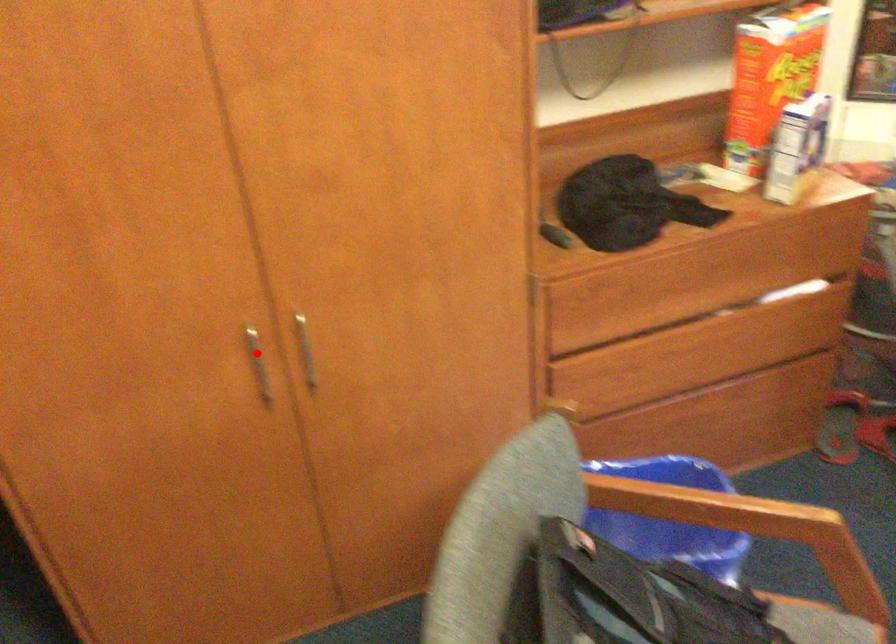
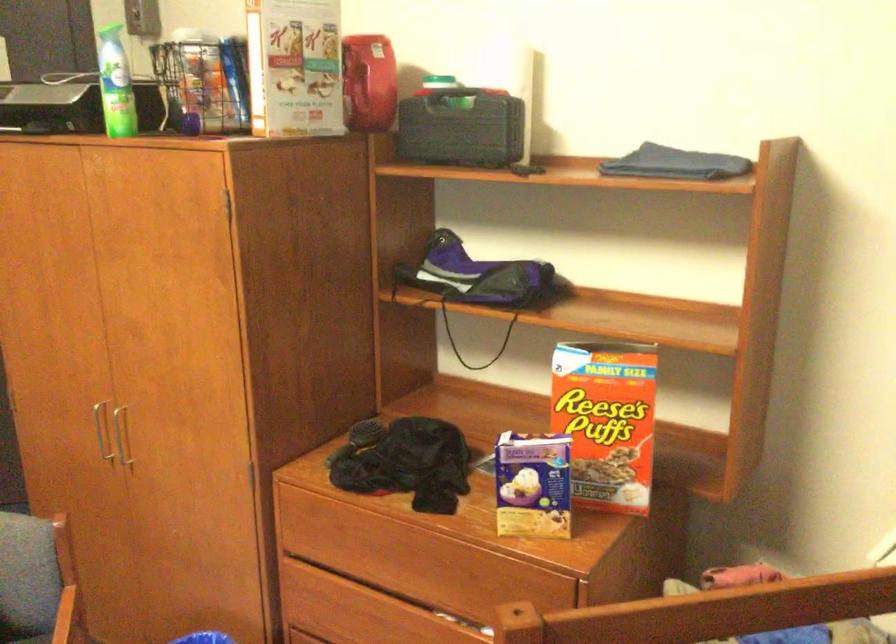
Find the pixel in the second image that matches the highlighted location in the first image.

(100, 431)